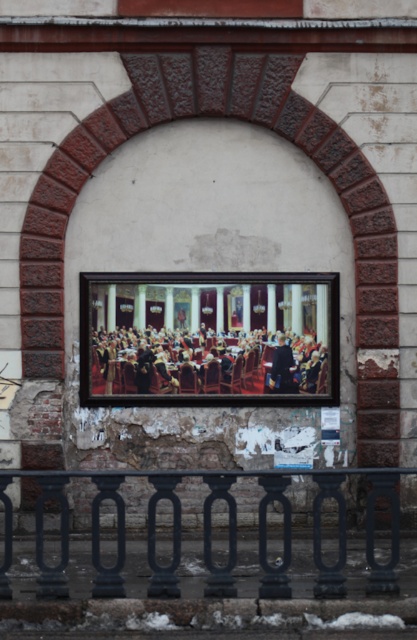
Is point (263, 390) positioned in front of point (279, 340)?

No, (263, 390) is further to viewer.

From the picture: Does formal attire person at center have a greater width compared to dark blue suit at center?

Yes, formal attire person at center is wider than dark blue suit at center.

Locate an element on the screen. This screenshot has width=417, height=640. formal attire person at center is located at coordinates (205, 362).

The image size is (417, 640). I want to click on formal attire person at center, so click(205, 362).

Which is in front, point (128, 476) or point (281, 364)?

Point (128, 476) is in front.

Can you confirm if smooth black railing at lower center is wider than dark blue suit at center?

Yes.

Is point (203, 509) more distant than point (286, 353)?

That is False.

Where is `smooth black railing at lower center`? smooth black railing at lower center is located at coordinates (208, 531).

Who is higher up, smooth black railing at lower center or formal attire person at center?

formal attire person at center

Can you confirm if smooth black railing at lower center is positioned below formal attire person at center?

Indeed, smooth black railing at lower center is positioned under formal attire person at center.

This screenshot has height=640, width=417. What do you see at coordinates (208, 531) in the screenshot?
I see `smooth black railing at lower center` at bounding box center [208, 531].

Locate an element on the screen. smooth black railing at lower center is located at coordinates point(208,531).